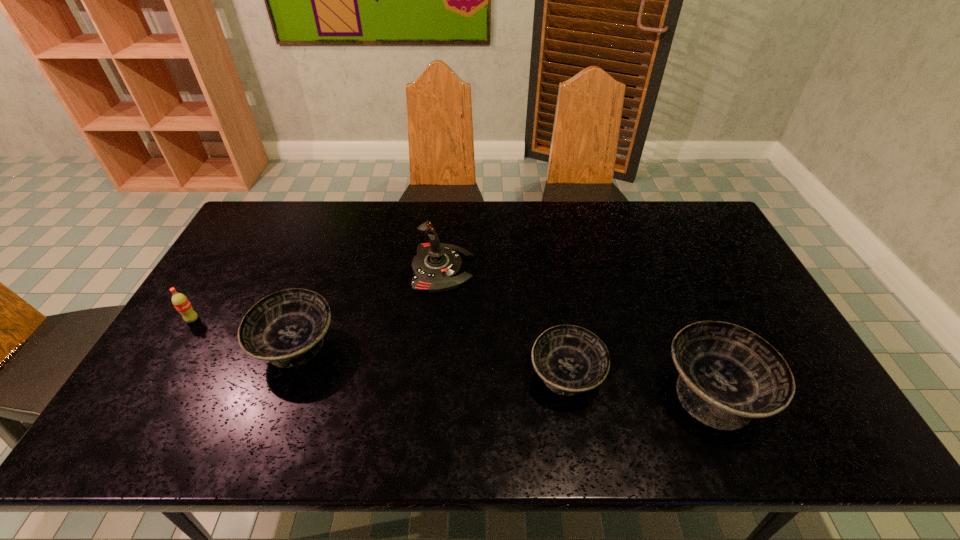
To achieve even spacing by inserting another bowl among them, please point to a vacant spot for this new bowl. Please provide its 2D coordinates. Your answer should be formatted as a tuple, i.e. [(x, y)], where the tuple contains the x and y coordinates of a point satisfying the conditions above.

[(427, 361)]